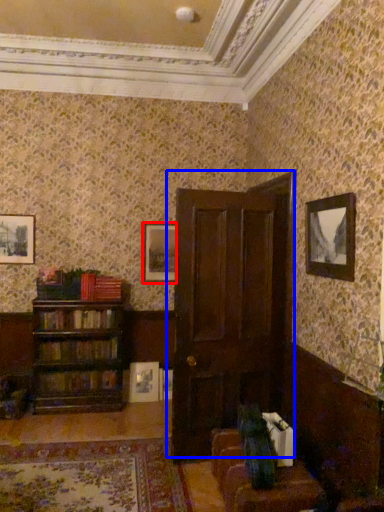
Question: Which of the following is the closest to the observer, picture frame (highlighted by a red box) or door (highlighted by a blue box)?

Choices:
 (A) picture frame
 (B) door

Answer: (B)